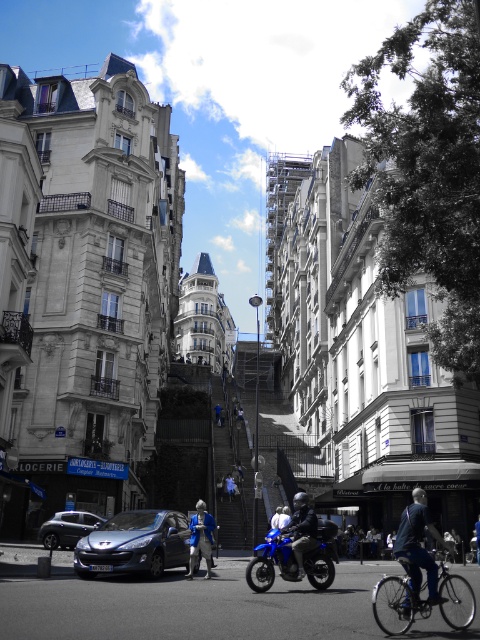
You are standing at the point with coordinates point (69,540) and want to walk towards the point with coordinates point (395,592). Which direction should you move to reach your destination?

You should move forward because point (395,592) is in front of point (69,540).

Consider the image. You are a delivery person who needs to park your vehicle in a tight space between two parked cars. You see a blue metallic motorcycle at center and a blue fabric jacket at center. Which vehicle can you fit more easily into the space?

The blue metallic motorcycle at center has a smaller size compared to blue fabric jacket at center, so it can be more easily fit into the tight parking space.

In the scene shown: You are a pedestrian standing at the center of the street. You need to cross the street to reach the historic building with scaffolding. Which direction should you walk to avoid the blue matte bicycle at lower right and the matte black car at lower left?

You should walk towards the left side of the street to avoid the blue matte bicycle at lower right and the matte black car at lower left, as the blue matte bicycle is positioned to the right of the matte black car. This way, moving left would keep you away from both obstacles.